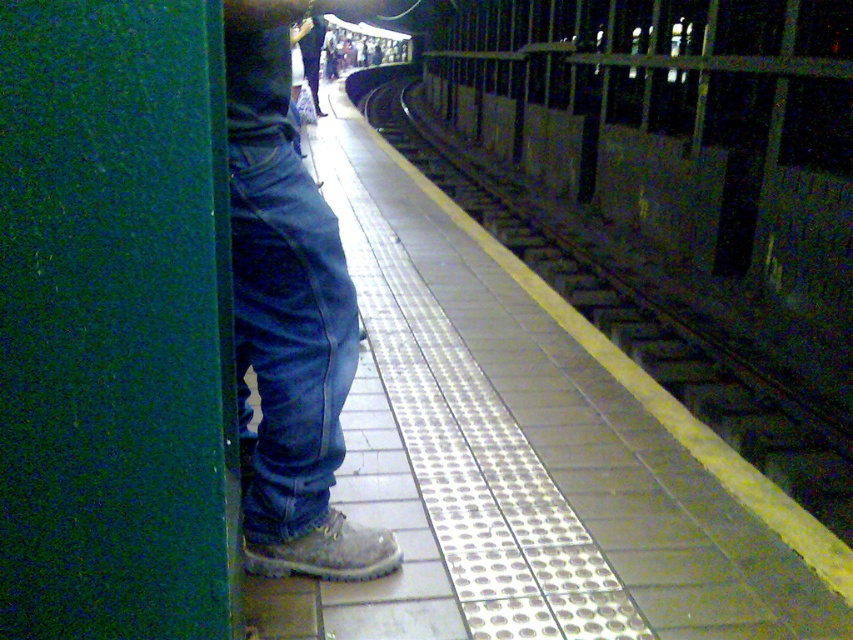
Who is positioned more to the left, denim jeans at center or metal/smooth train track at center?

Positioned to the left is denim jeans at center.

Does denim jeans at center appear under metal/smooth train track at center?

Yes, denim jeans at center is below metal/smooth train track at center.

Identify the location of denim jeans at center. (289, 314).